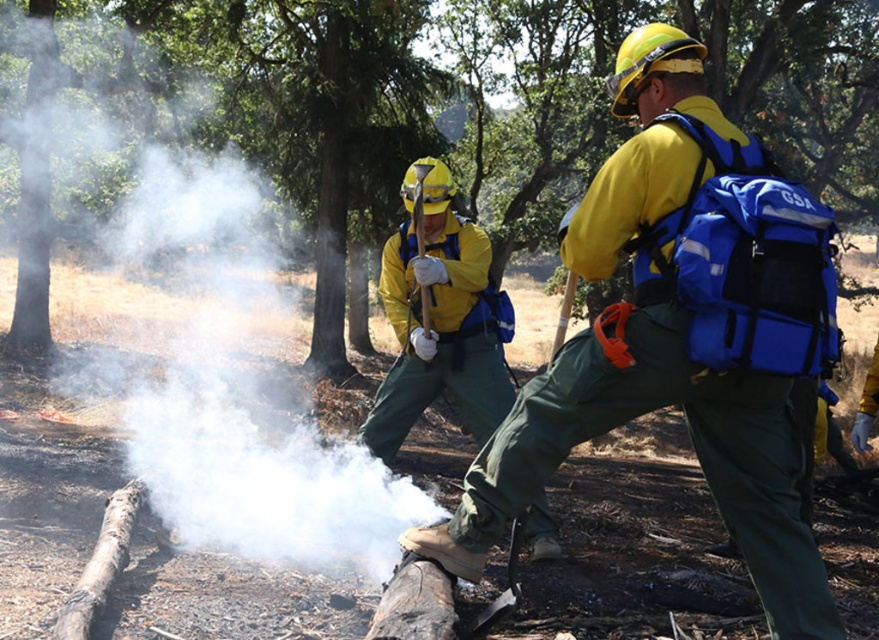
You are standing at the camera position and want to reach point [593,80]. If you can walk 2 meters per minute, how many minutes will it take you to reach there?

The distance between you and point [593,80] is 19.56 meters. At a walking speed of 2 meters per minute, it will take 9.78 minutes to reach there.

You are standing at the point marked as point (691,113). You want to throw a water bottle to a friend who is exactly 3 meters away from you. Can you reach your friend with this throw?

The distance between you and your friend is exactly 3 meters, so yes, you can reach them with a throw of 3 meters.

You are a firefighter trying to extinguish a small fire near the green textured log at center. Your water hose can spray up to 12 meters. Can you reach the fire from your current position?

The green textured log at center is 14.10 meters away from camera. Since the water hose can only spray up to 12 meters, you cannot reach the fire from your current position.